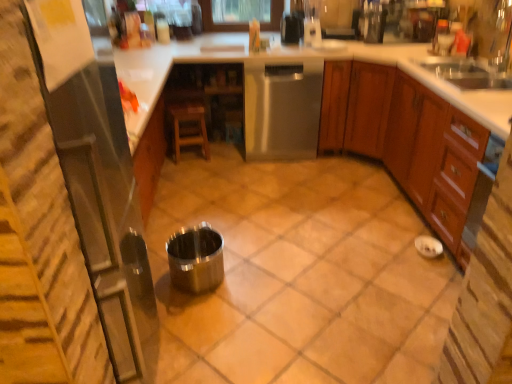
Question: In the image, is stainless steel dishwasher at center on the left side or the right side of clear glass blender at upper center, marked as the 5th appliance in a front-to-back arrangement?

Choices:
 (A) right
 (B) left

Answer: (B)

Question: Is stainless steel dishwasher at center inside or outside of clear glass blender at upper center, arranged as the fifth appliance when ordered from the bottom?

Choices:
 (A) inside
 (B) outside

Answer: (B)

Question: Which of these objects is positioned farthest from the metallic stainless steel coffee maker at upper right, arranged as the fourth appliance when viewed from the front?

Choices:
 (A) metallic stainless steel coffee maker at upper center, positioned as the 3th appliance in left-to-right order
 (B) polished metallic cup at center, placed as the 2th appliance when sorted from left to right
 (C) stainless steel trash can at center, the 5th appliance from the back
 (D) brown wood cabinet at right
 (E) wooden stool at center

Answer: (C)

Question: Based on their relative distances, which object is farther from the stainless steel trash can at center, the second appliance positioned from the bottom?

Choices:
 (A) stainless steel dishwasher at center
 (B) metallic silver at center
 (C) metallic stainless steel coffee maker at upper right, which is the second appliance in top-to-bottom order
 (D) metallic stainless steel coffee maker at upper center, marked as the third appliance in a front-to-back arrangement
 (E) polished metallic cup at center, marked as the second appliance in a front-to-back arrangement

Answer: (C)